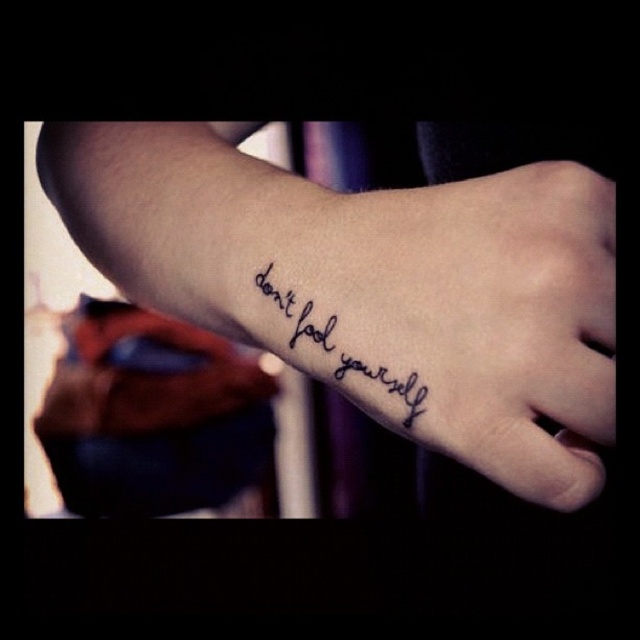
You are a tattoo artist assessing a client who wants to place a new tattoo on their forearm. The client has a black ink tattoo at lower center. The new tattoo should be placed 10 inches away from the existing one. Is this possible given the forearm length?

The black ink tattoo at lower center is 11.29 inches from the viewer. If the new tattoo needs to be placed 10 inches away from the existing one, it would require positioning it closer to the viewer than the current tattoo. However, the forearm length may not allow this placement without overlapping or exceeding the arm area. Further measurement is needed to confirm feasibility.

You are a tattoo artist reviewing a client photo. The client wants to add a new small star tattoo above the existing black ink text at lower left. Can the star be placed there without overlapping the black ink tattoo at lower center?

The black ink tattoo at lower center is positioned over the black ink text at lower left, meaning the new star tattoo cannot be placed there as it would overlap with the existing black ink tattoo at lower center.

In the scene shown: You are a tattoo artist assessing a client who wants to add a new tattoo. The client has a black ink tattoo at lower center and a black ink text at lower left on their forearm. The new tattoo must fit between these two existing ones. Given their widths, which existing tattoo should the new tattoo be placed closer to?

The new tattoo should be placed closer to the black ink text at lower left because the black ink tattoo at lower center is wider than the black ink text at lower left, leaving more space near the narrower text.